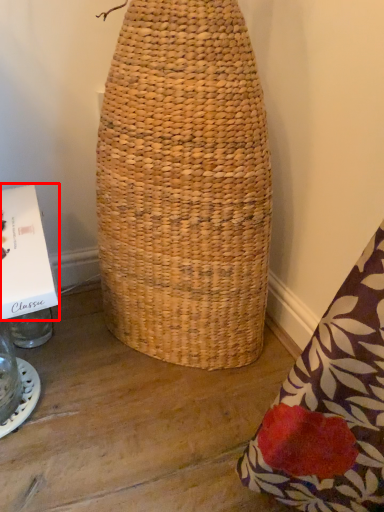
Question: From the image's perspective, where is cardboard box (annotated by the red box) located in relation to glass jar in the image?

Choices:
 (A) below
 (B) above

Answer: (B)